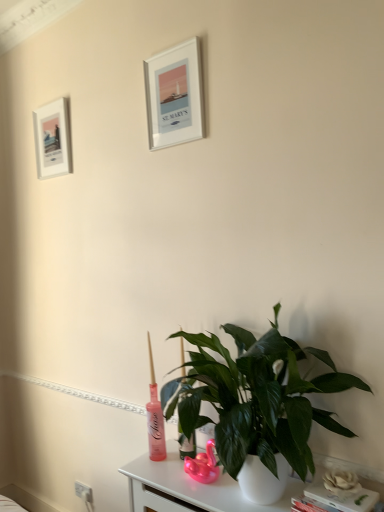
Question: Should I look upward or downward to see green glossy plant at lower center?

Choices:
 (A) down
 (B) up

Answer: (A)

Question: Which direction should I rotate to look at silver metallic picture frame at upper center, which is counted as the first picture frame, starting from the right, — up or down?

Choices:
 (A) down
 (B) up

Answer: (B)

Question: Does white matte flower at lower right have a lesser height compared to silver metallic picture frame at upper center, which ranks as the 2th picture frame in left-to-right order?

Choices:
 (A) yes
 (B) no

Answer: (A)

Question: Is white matte flower at lower right turned away from silver metallic picture frame at upper center, which is counted as the first picture frame, starting from the right?

Choices:
 (A) no
 (B) yes

Answer: (A)

Question: Does white matte flower at lower right have a smaller size compared to silver metallic picture frame at upper center, which ranks as the 2th picture frame in left-to-right order?

Choices:
 (A) yes
 (B) no

Answer: (A)

Question: From a real-world perspective, is white matte flower at lower right positioned over silver metallic picture frame at upper center, acting as the 1th picture frame starting from the front, based on gravity?

Choices:
 (A) no
 (B) yes

Answer: (A)

Question: Is white matte flower at lower right in contact with silver metallic picture frame at upper center, which is counted as the first picture frame, starting from the right?

Choices:
 (A) no
 (B) yes

Answer: (A)

Question: Is white matte flower at lower right at the left side of silver metallic picture frame at upper center, which ranks as the 2th picture frame in left-to-right order?

Choices:
 (A) no
 (B) yes

Answer: (A)

Question: From the image's perspective, is white plastic electric outlet at lower left on white glossy table at lower center?

Choices:
 (A) yes
 (B) no

Answer: (B)

Question: Considering the relative positions of white plastic electric outlet at lower left and white glossy table at lower center in the image provided, is white plastic electric outlet at lower left in front of white glossy table at lower center?

Choices:
 (A) yes
 (B) no

Answer: (B)

Question: Is white plastic electric outlet at lower left taller than white glossy table at lower center?

Choices:
 (A) yes
 (B) no

Answer: (B)

Question: From the image's perspective, is white plastic electric outlet at lower left beneath white glossy table at lower center?

Choices:
 (A) yes
 (B) no

Answer: (A)

Question: Does white plastic electric outlet at lower left have a smaller size compared to white glossy table at lower center?

Choices:
 (A) yes
 (B) no

Answer: (A)

Question: Is white plastic electric outlet at lower left next to white glossy table at lower center?

Choices:
 (A) no
 (B) yes

Answer: (A)

Question: Can you confirm if silver metallic picture frame at upper center, which ranks as the 2th picture frame in left-to-right order, is wider than white matte picture frame at upper left, which appears as the first picture frame when viewed from the left?

Choices:
 (A) yes
 (B) no

Answer: (A)